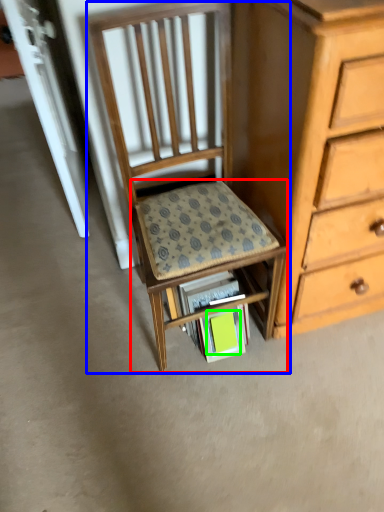
Question: Which object is positioned closest to step stool (highlighted by a red box)? Select from chair (highlighted by a blue box) and paperback book (highlighted by a green box).

Choices:
 (A) chair
 (B) paperback book

Answer: (A)